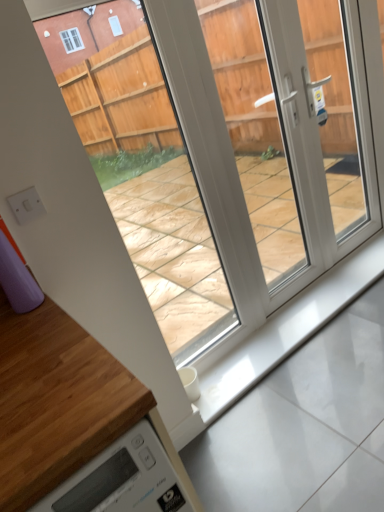
Where is `wooden at lower left`? The height and width of the screenshot is (512, 384). wooden at lower left is located at coordinates (57, 401).

This screenshot has height=512, width=384. What do you see at coordinates (305, 426) in the screenshot?
I see `white glossy concrete at bottom` at bounding box center [305, 426].

Locate an element on the screen. wooden at lower left is located at coordinates (57, 401).

Which is further, (x=149, y=101) or (x=23, y=369)?

The point (x=149, y=101) is more distant.

From the image's perspective, which is above, transparent plastic glass door at center or wooden at lower left?

transparent plastic glass door at center appears higher in the image.

Which object is wider, transparent plastic glass door at center or wooden at lower left?

Wider between the two is wooden at lower left.

Is wooden at lower left located within transparent plastic glass door at center?

No, transparent plastic glass door at center does not contain wooden at lower left.

Considering the sizes of objects white glossy concrete at bottom and wooden at lower left in the image provided, who is shorter, white glossy concrete at bottom or wooden at lower left?

white glossy concrete at bottom is shorter.

Can you confirm if white glossy concrete at bottom is wider than wooden at lower left?

In fact, white glossy concrete at bottom might be narrower than wooden at lower left.

From the image's perspective, is white glossy concrete at bottom positioned above or below wooden at lower left?

Based on their image positions, white glossy concrete at bottom is located above wooden at lower left.

From a real-world perspective, which object stands above the other?

transparent plastic glass door at center is physically above.

Between transparent plastic glass door at center and white glossy concrete at bottom, which one has larger size?

Bigger between the two is transparent plastic glass door at center.

Is transparent plastic glass door at center closer to the viewer compared to white glossy concrete at bottom?

Yes, transparent plastic glass door at center is closer to the viewer.

Would you say white glossy concrete at bottom is part of wooden at lower left's contents?

No, white glossy concrete at bottom is not surrounded by wooden at lower left.

Looking at this image, from a real-world perspective, is wooden at lower left positioned above or below white glossy concrete at bottom?

wooden at lower left is above white glossy concrete at bottom.

Which object is more forward, wooden at lower left or white glossy concrete at bottom?

wooden at lower left.

Is point (6, 354) closer or farther from the camera than point (233, 110)?

Clearly, point (6, 354) is closer to the camera than point (233, 110).

Is transparent plastic glass door at center surrounded by wooden at lower left?

Definitely not — transparent plastic glass door at center is not inside wooden at lower left.

Measure the distance from wooden at lower left to transparent plastic glass door at center.

wooden at lower left and transparent plastic glass door at center are 2.15 meters apart from each other.

Is wooden at lower left oriented towards transparent plastic glass door at center?

No, wooden at lower left is not oriented towards transparent plastic glass door at center.

Is white glossy concrete at bottom with transparent plastic glass door at center?

No.

Which of these two, white glossy concrete at bottom or transparent plastic glass door at center, stands shorter?

white glossy concrete at bottom.

Is white glossy concrete at bottom located outside transparent plastic glass door at center?

Indeed, white glossy concrete at bottom is completely outside transparent plastic glass door at center.

Based on the photo, between white glossy concrete at bottom and transparent plastic glass door at center, which one is positioned in front?

Positioned in front is transparent plastic glass door at center.

Find the location of a particular element. The width and height of the screenshot is (384, 512). glass door located above the wooden at lower left (from the image's perspective) is located at coordinates (225, 152).

Where is `concrete behind the wooden at lower left`? This screenshot has width=384, height=512. concrete behind the wooden at lower left is located at coordinates (305, 426).

Looking at the image, which one is located closer to transparent plastic glass door at center, white glossy concrete at bottom or wooden at lower left?

white glossy concrete at bottom.

Which object lies nearer to the anchor point transparent plastic glass door at center, wooden at lower left or white glossy concrete at bottom?

Based on the image, white glossy concrete at bottom appears to be nearer to transparent plastic glass door at center.

Estimate the real-world distances between objects in this image. Which object is further from wooden at lower left, white glossy concrete at bottom or transparent plastic glass door at center?

transparent plastic glass door at center.

When comparing their distances from wooden at lower left, does transparent plastic glass door at center or white glossy concrete at bottom seem closer?

white glossy concrete at bottom.

When comparing their distances from white glossy concrete at bottom, does transparent plastic glass door at center or wooden at lower left seem closer?

wooden at lower left lies closer to white glossy concrete at bottom than the other object.

Estimate the real-world distances between objects in this image. Which object is further from white glossy concrete at bottom, wooden at lower left or transparent plastic glass door at center?

The object further to white glossy concrete at bottom is transparent plastic glass door at center.

Find the location of a particular element. The height and width of the screenshot is (512, 384). glass door between wooden at lower left and white glossy concrete at bottom from front to back is located at coordinates (225, 152).